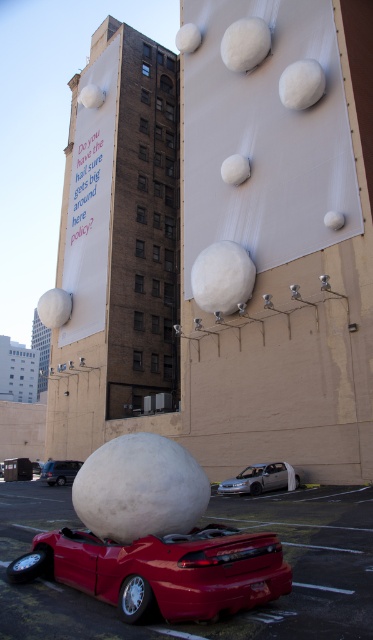
Question: Is shiny red car at lower center closer to the viewer compared to silver metallic sedan at center?

Choices:
 (A) no
 (B) yes

Answer: (B)

Question: Which object appears farthest from the camera in this image?

Choices:
 (A) metallic red car at lower left
 (B) silver metallic sedan at center

Answer: (A)

Question: Observing the image, what is the correct spatial positioning of metallic red car at lower center in reference to shiny red car at lower center?

Choices:
 (A) below
 (B) above

Answer: (A)

Question: Which point is closer to the camera?

Choices:
 (A) click(230, 518)
 (B) click(271, 470)
 (C) click(48, 470)
 (D) click(165, 554)

Answer: (D)

Question: Can you confirm if metallic red car at lower center is thinner than shiny red car at lower center?

Choices:
 (A) no
 (B) yes

Answer: (A)

Question: Which point appears closest to the camera in this image?

Choices:
 (A) (73, 472)
 (B) (349, 492)
 (C) (104, 557)

Answer: (C)